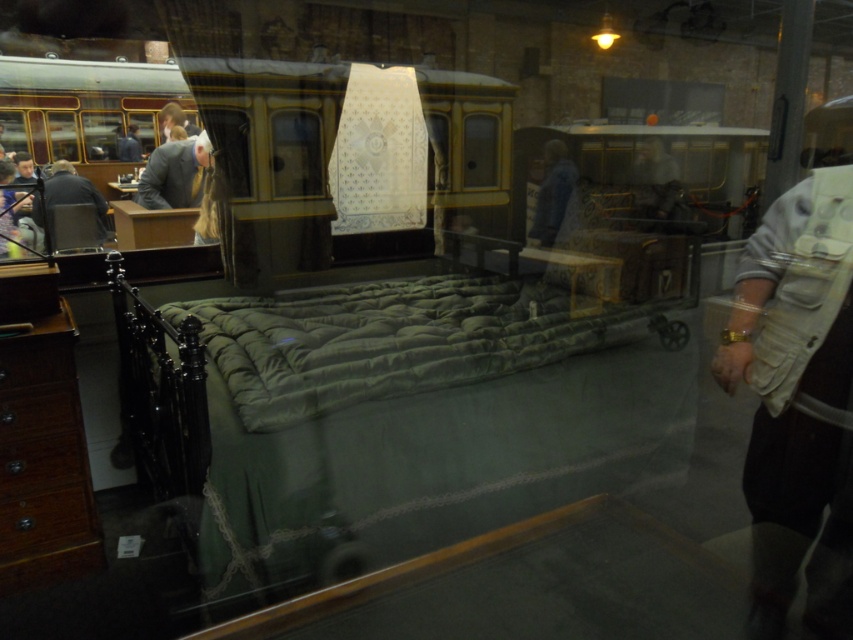
Can you confirm if brown wood dresser at lower left is wider than dark gray fabric jacket at left?

Incorrect, brown wood dresser at lower left's width does not surpass dark gray fabric jacket at left's.

Based on the photo, can you confirm if brown wood dresser at lower left is smaller than dark gray fabric jacket at left?

Yes.

Identify the location of brown wood dresser at lower left. click(x=44, y=461).

Does wooden drawer at lower left appear over blue denim jacket at center?

No, wooden drawer at lower left is not above blue denim jacket at center.

Does wooden drawer at lower left have a lesser height compared to blue denim jacket at center?

Indeed, wooden drawer at lower left has a lesser height compared to blue denim jacket at center.

Locate an element on the screen. Image resolution: width=853 pixels, height=640 pixels. wooden drawer at lower left is located at coordinates (38, 412).

Where is `wooden drawer at lower left`? This screenshot has height=640, width=853. wooden drawer at lower left is located at coordinates (38, 412).

Consider the image. Can you confirm if blue denim jacket at center is positioned to the left of dark gray fabric jacket at left?

Incorrect, blue denim jacket at center is not on the left side of dark gray fabric jacket at left.

Is blue denim jacket at center smaller than dark gray fabric jacket at left?

Indeed, blue denim jacket at center has a smaller size compared to dark gray fabric jacket at left.

Does point (577, 176) come closer to viewer compared to point (73, 182)?

Yes, point (577, 176) is closer to viewer.

Where is `blue denim jacket at center`? blue denim jacket at center is located at coordinates (552, 193).